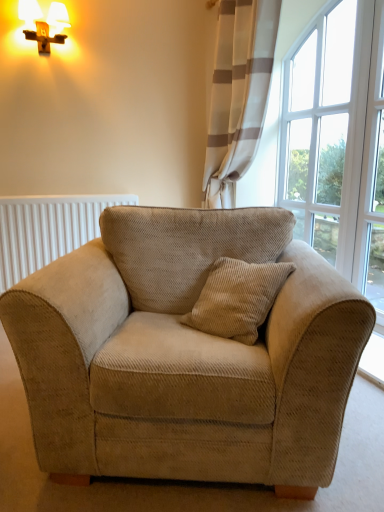
Question: Can you confirm if beige corduroy armchair at center is wider than white ribbed radiator at left?

Choices:
 (A) yes
 (B) no

Answer: (A)

Question: Is beige corduroy armchair at center thinner than white ribbed radiator at left?

Choices:
 (A) yes
 (B) no

Answer: (B)

Question: From a real-world perspective, is beige corduroy armchair at center below white ribbed radiator at left?

Choices:
 (A) yes
 (B) no

Answer: (A)

Question: Is beige corduroy armchair at center directly adjacent to white ribbed radiator at left?

Choices:
 (A) yes
 (B) no

Answer: (B)

Question: Is there a large distance between beige corduroy armchair at center and white ribbed radiator at left?

Choices:
 (A) no
 (B) yes

Answer: (B)

Question: Is clear glass window at upper right spatially inside beige corduroy armchair at center, or outside of it?

Choices:
 (A) inside
 (B) outside

Answer: (B)

Question: Considering the positions of point (350, 168) and point (178, 382), is point (350, 168) closer or farther from the camera than point (178, 382)?

Choices:
 (A) farther
 (B) closer

Answer: (A)

Question: From the image's perspective, is clear glass window at upper right above or below beige corduroy armchair at center?

Choices:
 (A) below
 (B) above

Answer: (B)

Question: Would you say clear glass window at upper right is to the left or to the right of beige corduroy armchair at center in the picture?

Choices:
 (A) left
 (B) right

Answer: (B)

Question: Looking at their shapes, would you say white ribbed radiator at left is wider or thinner than white textured curtain at upper right?

Choices:
 (A) thin
 (B) wide

Answer: (A)

Question: In the image, is white ribbed radiator at left positioned in front of or behind white textured curtain at upper right?

Choices:
 (A) front
 (B) behind

Answer: (B)

Question: Based on their positions, is white ribbed radiator at left located to the left or right of white textured curtain at upper right?

Choices:
 (A) right
 (B) left

Answer: (B)

Question: Looking at the image, does white ribbed radiator at left seem bigger or smaller compared to white textured curtain at upper right?

Choices:
 (A) small
 (B) big

Answer: (A)

Question: From the image's perspective, is clear glass window at upper right above or below white textured curtain at upper right?

Choices:
 (A) below
 (B) above

Answer: (A)

Question: In terms of height, does clear glass window at upper right look taller or shorter compared to white textured curtain at upper right?

Choices:
 (A) tall
 (B) short

Answer: (A)